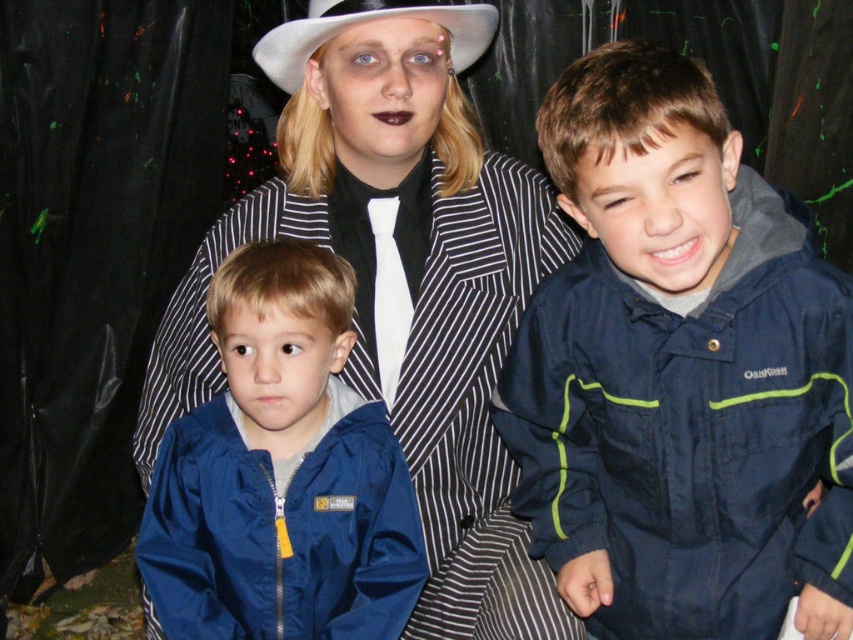
Question: Does blue fabric jacket at left appear on the left side of white felt cowboy hat at upper center?

Choices:
 (A) no
 (B) yes

Answer: (A)

Question: Among these points, which one is farthest from the camera?

Choices:
 (A) (662, 497)
 (B) (426, 3)

Answer: (B)

Question: Which point is closer to the camera taking this photo?

Choices:
 (A) (258, 564)
 (B) (608, 237)

Answer: (B)

Question: Does blue fabric jacket at left appear under matte blue jacket at lower left?

Choices:
 (A) no
 (B) yes

Answer: (A)

Question: Which of the following is the farthest from the observer?

Choices:
 (A) (289, 74)
 (B) (344, 358)

Answer: (A)

Question: Considering the relative positions of navy blue jacket at center and blue fabric jacket at left in the image provided, where is navy blue jacket at center located with respect to blue fabric jacket at left?

Choices:
 (A) right
 (B) left

Answer: (A)